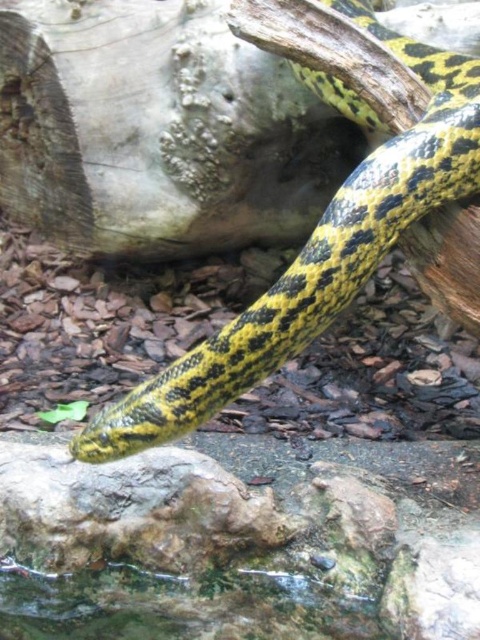
Can you confirm if yellow-green scales at lower center is positioned below green rough rock at center?

No, yellow-green scales at lower center is not below green rough rock at center.

Who is more distant from viewer, (442,164) or (274,516)?

The point (274,516) is more distant.

Does point (344, 291) come farther from viewer compared to point (110, 472)?

No, (344, 291) is in front of (110, 472).

Where is `yellow-green scales at lower center`? yellow-green scales at lower center is located at coordinates (315, 257).